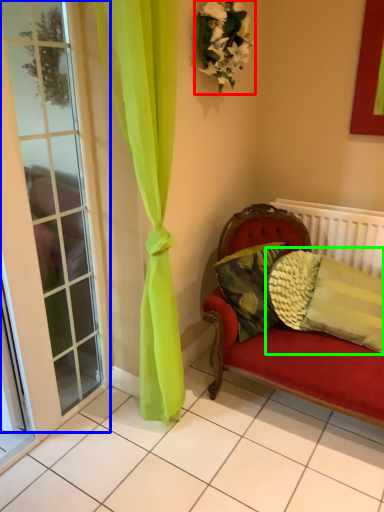
Question: Estimate the real-world distances between objects in this image. Which object is closer to floral arrangement (highlighted by a red box), window (highlighted by a blue box) or pillow (highlighted by a green box)?

Choices:
 (A) window
 (B) pillow

Answer: (A)